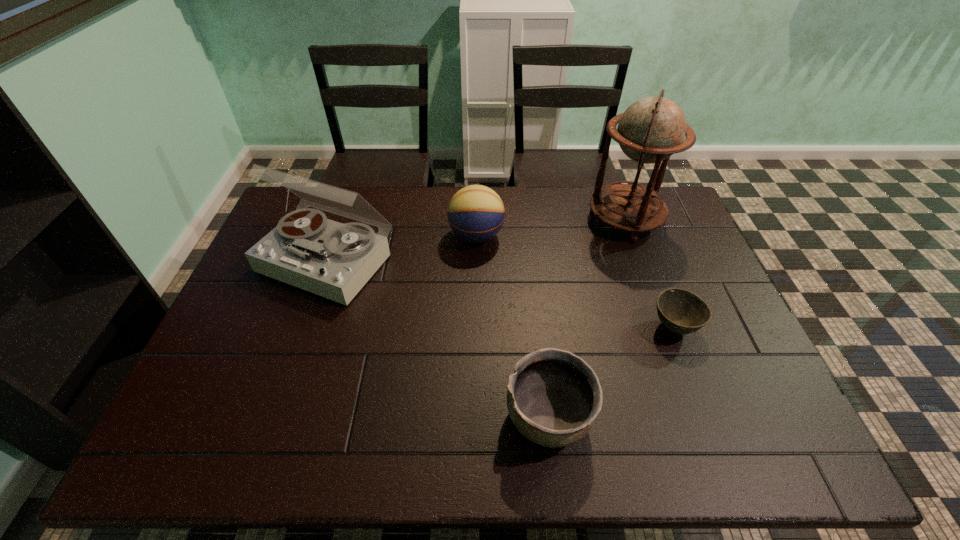
In order to click on vacant area that lies between the basketball and the globe in this screenshot , I will do `click(551, 228)`.

Where is `empty location between the bowl and the globe`? empty location between the bowl and the globe is located at coordinates (649, 274).

Image resolution: width=960 pixels, height=540 pixels. In order to click on vacant space that is in between the nearest object and the shortest object in this screenshot , I will do [x=612, y=373].

At what (x,y) coordinates should I click in order to perform the action: click on unoccupied area between the shortest object and the nearest object. Please return your answer as a coordinate pair (x, y). The width and height of the screenshot is (960, 540). Looking at the image, I should click on (612, 373).

Where is `free spot between the third tallest object and the leftmost object`? This screenshot has height=540, width=960. free spot between the third tallest object and the leftmost object is located at coordinates (402, 248).

The height and width of the screenshot is (540, 960). What are the coordinates of `vacant space that's between the second nearest object and the fourth shortest object` in the screenshot? It's located at (501, 294).

Image resolution: width=960 pixels, height=540 pixels. Identify the location of object that is the closest to the pottery. (680, 311).

At what (x,y) coordinates should I click in order to perform the action: click on object that ranks as the closest to the basketball. Please return your answer as a coordinate pair (x, y). Looking at the image, I should click on (334, 260).

What are the coordinates of `vacant region that satisfies the following two spatial constraints: 1. on the surface of the globe; 2. on the back side of the second nearest object` in the screenshot? It's located at (663, 327).

Identify the location of free space that satisfies the following two spatial constraints: 1. on the surface of the tallest object; 2. on the back side of the shortest object. The image size is (960, 540). (663, 327).